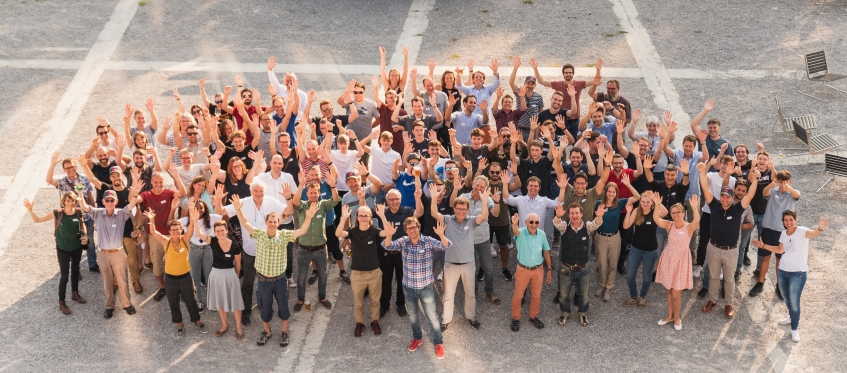
Identify the location of chairs. (821, 65), (784, 119), (815, 142), (836, 166).